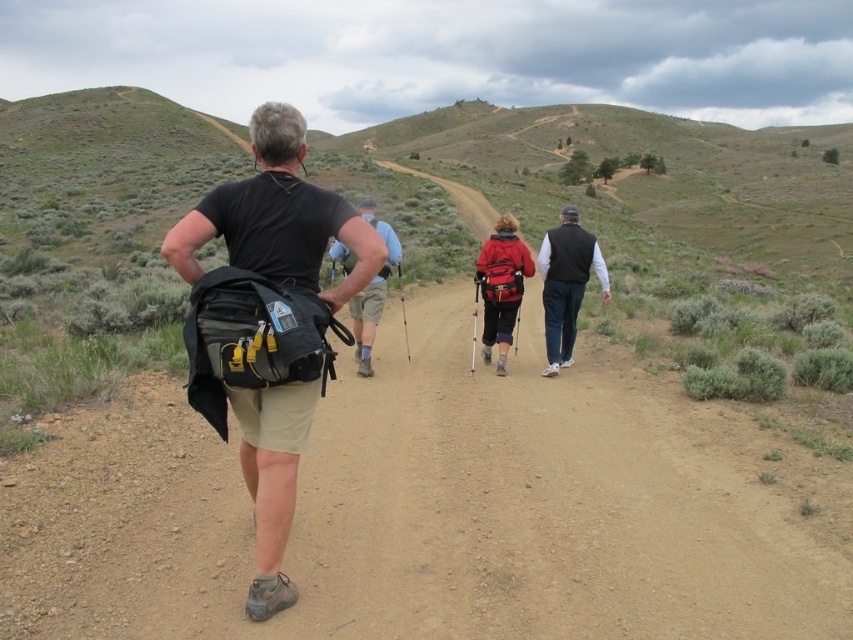
You are a hiker who needs to place a 12 feet long tent on the brown dirt track at center. The black fabric backpack at center is currently on the track. Can you place the tent without moving the backpack?

The brown dirt track at center and black fabric backpack at center are 14.21 feet apart. Since the tent is 12 feet long, there is enough space between them to place the tent without moving the backpack.

You are one of the hikers and you want to place your matte black backpack at center on the ground so that it doesn not block the brown dirt track at center. Which side of the track should you place it on?

The brown dirt track at center is to the left of the matte black backpack at center. To avoid blocking the track, you should place the matte black backpack at center to the right of the brown dirt track at center.